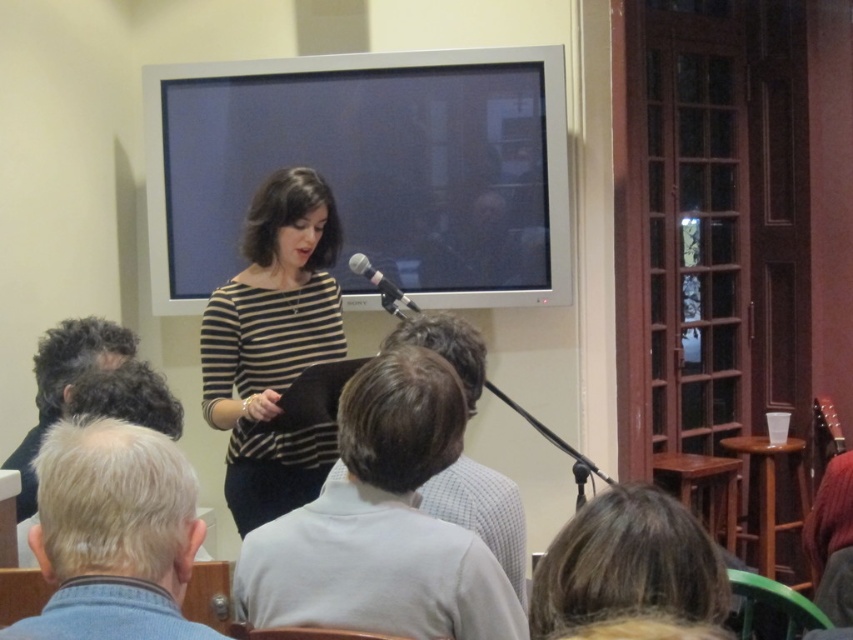
Where is the striped fabric at center located in the image?

The striped fabric at center is located at point [273,344].

You are an attendee sitting at the back of the room. You notice two items in the scene described earlier. One is the striped fabric at center and the other is the dark curly hair at lower left. Which of these two items appears taller from your perspective?

The striped fabric at center appears taller than the dark curly hair at lower left because it has a greater height compared to it.